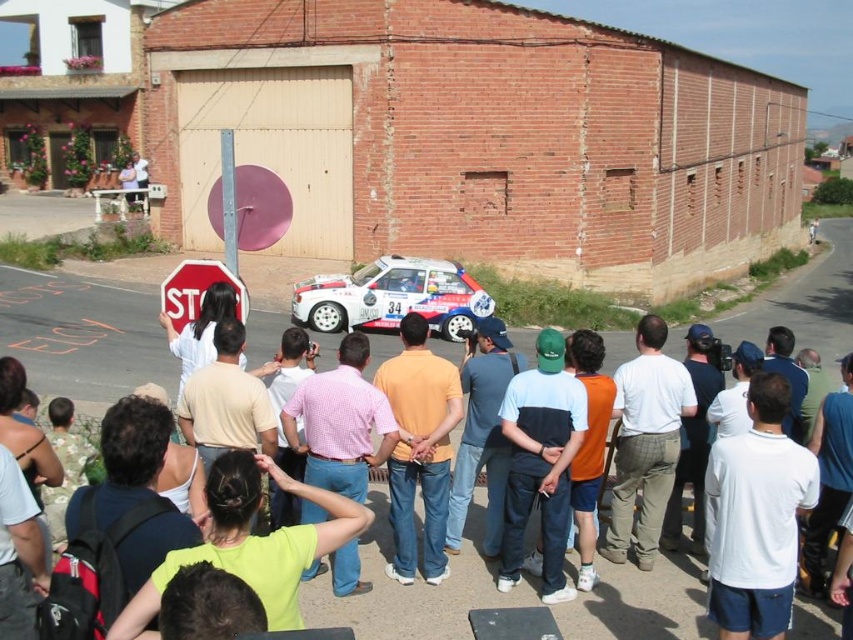
Consider the image. You are a photographer trying to capture a clear shot of the rally car number 34. There are two people in front of you wearing white cotton shirt at center and orange cotton shirt at center. Which one is blocking your view more due to their height?

The white cotton shirt at center is blocking your view more because it is much taller than the orange cotton shirt at center.

You are a photographer at the rally car race. You want to capture a photo of the pink checkered shirt at center and the red matte stop sign at center. Which object is closer to the camera?

The pink checkered shirt at center is positioned under the red matte stop sign at center, so the red matte stop sign at center is closer to the camera.